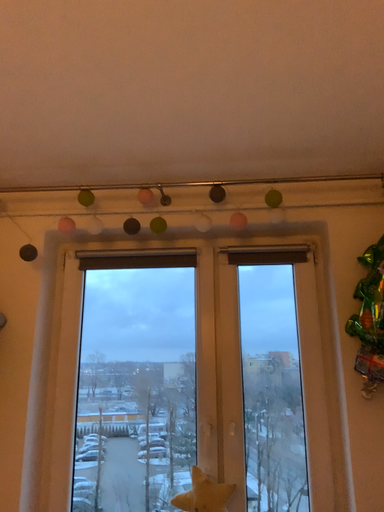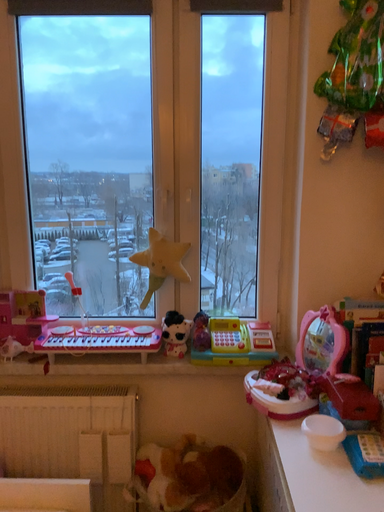
Question: Which way did the camera rotate in the video?

Choices:
 (A) rotated upward
 (B) rotated downward

Answer: (B)